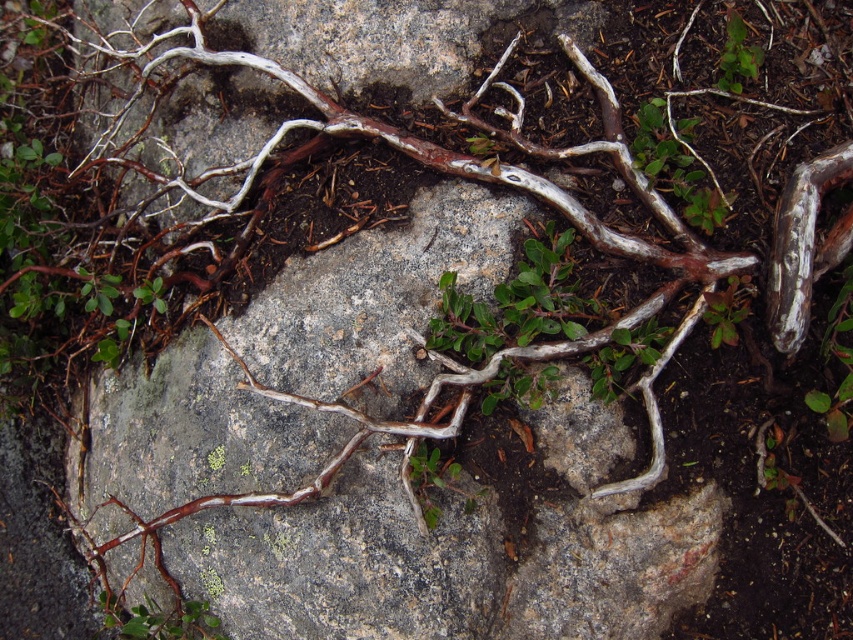
You are a hiker trying to navigate through the rocky terrain. You see two points marked on your map as point (x=136, y=627) and point (x=737, y=45). Which point is closer to your current position if you are facing the rock?

Point (x=136, y=627) is in front of point (x=737, y=45), so if you are facing the rock, point (x=136, y=627) is closer to your current position.

Based on the photo, you are a gardener examining the plants in the scene. You notice the green matte plant at lower left and the green leafy plant at upper right. Which plant is located lower in the image?

The green matte plant at lower left is positioned under the green leafy plant at upper right, so it is located lower in the image.

You are standing at the center of the rock in the image. Looking towards the lower left corner, can you see the green matte plant at lower left? Please explain based on its coordinates.

The green matte plant at lower left is located at coordinates point (160,620), which is very close to the lower left corner of the image. Since you are at the center of the rock, your line of sight towards the lower left corner would naturally include the green matte plant at lower left, so yes, you can see it.